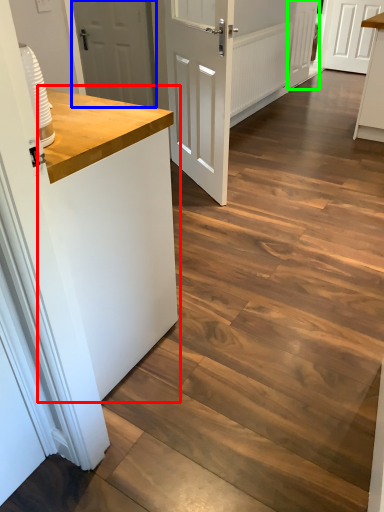
Question: Which object is positioned farthest from counter top (highlighted by a red box)? Select from door (highlighted by a blue box) and door (highlighted by a green box).

Choices:
 (A) door
 (B) door

Answer: (B)